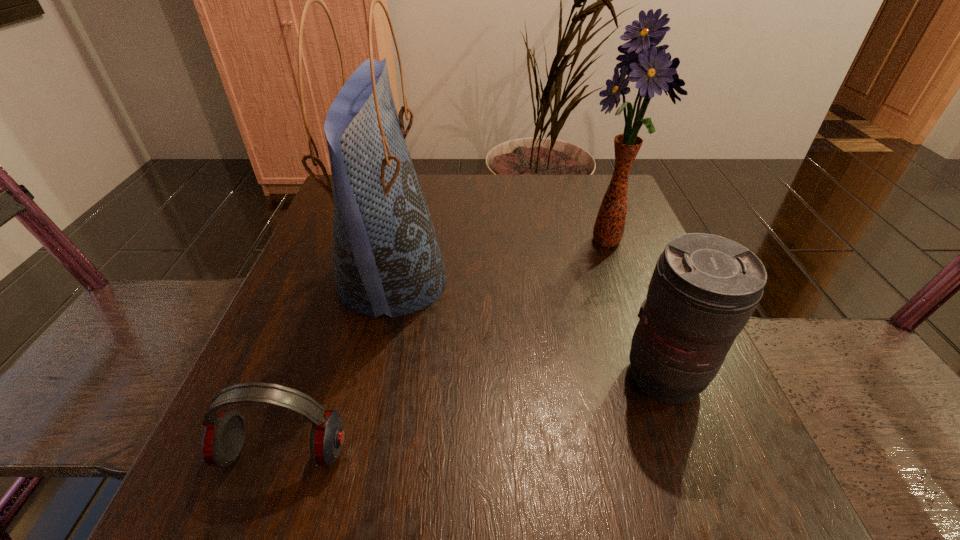
The width and height of the screenshot is (960, 540). I want to click on shopping bag, so click(x=387, y=260).

Find the location of a particular element. This screenshot has height=540, width=960. flower arrangement is located at coordinates (653, 70).

This screenshot has height=540, width=960. In order to click on telephoto lens in this screenshot , I will do `click(704, 289)`.

Where is `earphone`? Image resolution: width=960 pixels, height=540 pixels. earphone is located at coordinates (223, 438).

Locate an element on the screen. The image size is (960, 540). the shortest object is located at coordinates (223, 438).

Find the location of a particular element. This screenshot has height=540, width=960. free point located 0.170m on the back of the shopping bag is located at coordinates (412, 192).

At what (x,y) coordinates should I click in order to perform the action: click on vacant space located on the front of the flower arrangement. Please return your answer as a coordinate pair (x, y). The width and height of the screenshot is (960, 540). Looking at the image, I should click on (651, 356).

Identify the location of free space located on the side of the telephoto lens where the control switches are located. The image size is (960, 540). tap(690, 445).

Image resolution: width=960 pixels, height=540 pixels. In order to click on vacant space located 0.050m on the ear cups of the shortest object in this screenshot , I will do `click(260, 518)`.

You are a GUI agent. You are given a task and a screenshot of the screen. Output one action in this format:
    pyautogui.click(x=<x>, y=<y>)
    Task: Click on the object at the far edge
    This screenshot has width=960, height=540.
    Given the screenshot: What is the action you would take?
    point(653,70)